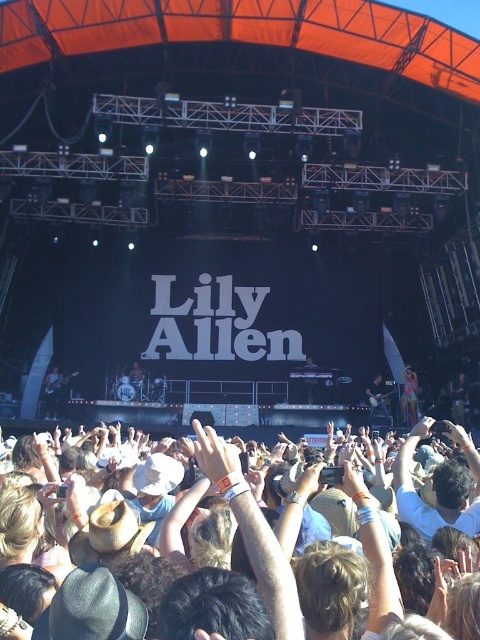
Question: Does pink fabric dress at center come behind shiny black guitar at center?

Choices:
 (A) no
 (B) yes

Answer: (B)

Question: Does white cloth hands at center appear over pink fabric dress at center?

Choices:
 (A) no
 (B) yes

Answer: (A)

Question: Which of these objects is positioned farthest from the shiny black guitar at center?

Choices:
 (A) white cloth hands at center
 (B) pink fabric dress at center

Answer: (A)

Question: Which point is closer to the camera?

Choices:
 (A) shiny black guitar at center
 (B) pink fabric dress at center
 (C) white cloth hands at center

Answer: (C)

Question: Does white cloth hands at center have a greater width compared to shiny black guitar at center?

Choices:
 (A) no
 (B) yes

Answer: (B)

Question: Estimate the real-world distances between objects in this image. Which object is closer to the pink fabric dress at center?

Choices:
 (A) white cloth hands at center
 (B) shiny black guitar at center

Answer: (B)